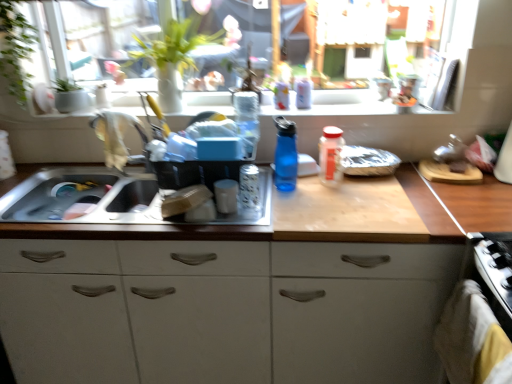
Question: Does green leafy plant at upper left have a larger size compared to transparent glass window at upper center?

Choices:
 (A) yes
 (B) no

Answer: (B)

Question: Can you confirm if green leafy plant at upper left is smaller than transparent glass window at upper center?

Choices:
 (A) no
 (B) yes

Answer: (B)

Question: Is green leafy plant at upper left at the right side of transparent glass window at upper center?

Choices:
 (A) yes
 (B) no

Answer: (B)

Question: Is green leafy plant at upper left thinner than transparent glass window at upper center?

Choices:
 (A) no
 (B) yes

Answer: (A)

Question: Considering the relative sizes of green leafy plant at upper left and transparent glass window at upper center in the image provided, is green leafy plant at upper left wider than transparent glass window at upper center?

Choices:
 (A) yes
 (B) no

Answer: (A)

Question: Is green leafy plant at upper left outside transparent glass window at upper center?

Choices:
 (A) no
 (B) yes

Answer: (B)

Question: From a real-world perspective, does translucent plastic bottle at center, the 1th bottle when ordered from right to left, sit lower than translucent glass jar at sink, arranged as the fifth bottle when viewed from the right?

Choices:
 (A) no
 (B) yes

Answer: (A)

Question: From the image's perspective, is translucent plastic bottle at center, the 1th bottle when ordered from right to left, above translucent glass jar at sink, the first bottle when ordered from left to right?

Choices:
 (A) yes
 (B) no

Answer: (A)

Question: Is translucent plastic bottle at center, the 1th bottle when ordered from right to left, bigger than translucent glass jar at sink, arranged as the fifth bottle when viewed from the right?

Choices:
 (A) yes
 (B) no

Answer: (A)

Question: Is translucent plastic bottle at center, the 1th bottle when ordered from right to left, at the left side of translucent glass jar at sink, the first bottle when ordered from left to right?

Choices:
 (A) yes
 (B) no

Answer: (B)

Question: Is translucent plastic bottle at center, the fifth bottle positioned from the left, not inside translucent glass jar at sink, arranged as the fifth bottle when viewed from the right?

Choices:
 (A) no
 (B) yes

Answer: (B)

Question: Can you confirm if translucent plastic bottle at center, the fifth bottle positioned from the left, is smaller than translucent glass jar at sink, arranged as the fifth bottle when viewed from the right?

Choices:
 (A) no
 (B) yes

Answer: (A)

Question: Is matte white window sill at upper center bigger than translucent plastic bottle at center, marked as the third bottle in a right-to-left arrangement?

Choices:
 (A) no
 (B) yes

Answer: (B)